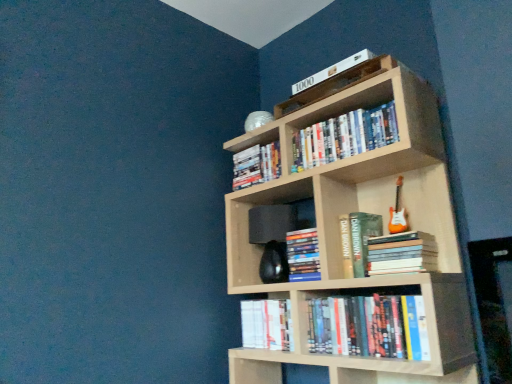
Question: Is hardcover books at lower center, the seventh book from the top, behind hardcover book at center, which is the 4th book in top-to-bottom order?

Choices:
 (A) yes
 (B) no

Answer: (B)

Question: Is hardcover books at lower center, which appears as the second book when ordered from the bottom, not inside hardcover book at center, which is the 4th book in top-to-bottom order?

Choices:
 (A) yes
 (B) no

Answer: (A)

Question: Is hardcover books at lower center, which appears as the second book when ordered from the bottom, facing away from hardcover book at center, the 5th book positioned from the bottom?

Choices:
 (A) no
 (B) yes

Answer: (A)

Question: Is hardcover books at lower center, the seventh book from the top, placed right next to hardcover book at center, which is the 4th book in top-to-bottom order?

Choices:
 (A) no
 (B) yes

Answer: (A)

Question: Does hardcover books at lower center, which appears as the second book when ordered from the bottom, lie in front of hardcover book at center, which is the 4th book in top-to-bottom order?

Choices:
 (A) no
 (B) yes

Answer: (B)

Question: Does point (392, 258) appear closer or farther from the camera than point (311, 253)?

Choices:
 (A) farther
 (B) closer

Answer: (B)

Question: Would you say hardcover books at center, placed as the fifth book when sorted from top to bottom, is inside or outside hardcover book at center, which appears as the third book when ordered from the bottom?

Choices:
 (A) inside
 (B) outside

Answer: (B)

Question: From a real-world perspective, is hardcover books at center, placed as the fifth book when sorted from top to bottom, above or below hardcover book at center, the sixth book positioned from the top?

Choices:
 (A) below
 (B) above

Answer: (A)

Question: In terms of size, does hardcover books at center, placed as the fifth book when sorted from top to bottom, appear bigger or smaller than hardcover book at center, which appears as the third book when ordered from the bottom?

Choices:
 (A) big
 (B) small

Answer: (B)

Question: Is point (342, 148) positioned closer to the camera than point (284, 193)?

Choices:
 (A) closer
 (B) farther

Answer: (A)

Question: Considering the positions of hardcover books at upper center, which is the seventh book in bottom-to-top order, and black matte speaker at center in the image, is hardcover books at upper center, which is the seventh book in bottom-to-top order, taller or shorter than black matte speaker at center?

Choices:
 (A) tall
 (B) short

Answer: (B)

Question: Is hardcover books at upper center, which is the seventh book in bottom-to-top order, wider or thinner than black matte speaker at center?

Choices:
 (A) thin
 (B) wide

Answer: (A)

Question: From the image's perspective, is hardcover books at upper center, the 2th book from the top, above or below black matte speaker at center?

Choices:
 (A) above
 (B) below

Answer: (A)

Question: Is white paper book at lower center, the eighth book from the top, taller or shorter than black matte speaker at center?

Choices:
 (A) short
 (B) tall

Answer: (A)

Question: Considering the positions of point (286, 321) and point (247, 228), is point (286, 321) closer or farther from the camera than point (247, 228)?

Choices:
 (A) farther
 (B) closer

Answer: (B)